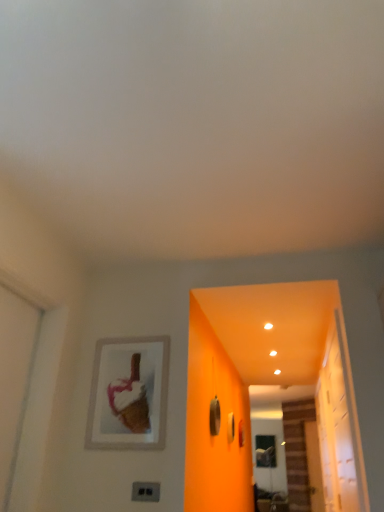
Question: Could matte silver picture frame at upper left be considered to be inside transparent glass screen door at lower right?

Choices:
 (A) yes
 (B) no

Answer: (B)

Question: Does transparent glass screen door at lower right appear on the left side of matte silver picture frame at upper left?

Choices:
 (A) yes
 (B) no

Answer: (B)

Question: Is the position of transparent glass screen door at lower right more distant than that of matte silver picture frame at upper left?

Choices:
 (A) yes
 (B) no

Answer: (A)

Question: Considering the relative sizes of transparent glass screen door at lower right and matte silver picture frame at upper left in the image provided, is transparent glass screen door at lower right wider than matte silver picture frame at upper left?

Choices:
 (A) yes
 (B) no

Answer: (A)

Question: Can you confirm if transparent glass screen door at lower right is smaller than matte silver picture frame at upper left?

Choices:
 (A) yes
 (B) no

Answer: (B)

Question: Considering the positions of black plastic electric outlet at lower center and transparent glass screen door at lower right in the image, is black plastic electric outlet at lower center taller or shorter than transparent glass screen door at lower right?

Choices:
 (A) tall
 (B) short

Answer: (B)

Question: Does point (157, 488) appear closer or farther from the camera than point (271, 439)?

Choices:
 (A) closer
 (B) farther

Answer: (A)

Question: From the image's perspective, is black plastic electric outlet at lower center located above or below transparent glass screen door at lower right?

Choices:
 (A) below
 (B) above

Answer: (B)

Question: Visually, is black plastic electric outlet at lower center positioned to the left or to the right of transparent glass screen door at lower right?

Choices:
 (A) right
 (B) left

Answer: (B)

Question: Do you think transparent glass screen door at lower right is within matte silver picture frame at upper left, or outside of it?

Choices:
 (A) inside
 (B) outside

Answer: (B)

Question: From their relative heights in the image, would you say transparent glass screen door at lower right is taller or shorter than matte silver picture frame at upper left?

Choices:
 (A) tall
 (B) short

Answer: (A)

Question: From the image's perspective, is transparent glass screen door at lower right above or below matte silver picture frame at upper left?

Choices:
 (A) below
 (B) above

Answer: (A)

Question: Looking at the image, does transparent glass screen door at lower right seem bigger or smaller compared to matte silver picture frame at upper left?

Choices:
 (A) small
 (B) big

Answer: (B)

Question: Considering the positions of transparent glass door at right and transparent glass screen door at lower right in the image, is transparent glass door at right bigger or smaller than transparent glass screen door at lower right?

Choices:
 (A) big
 (B) small

Answer: (B)

Question: From a real-world perspective, is transparent glass door at right above or below transparent glass screen door at lower right?

Choices:
 (A) above
 (B) below

Answer: (A)